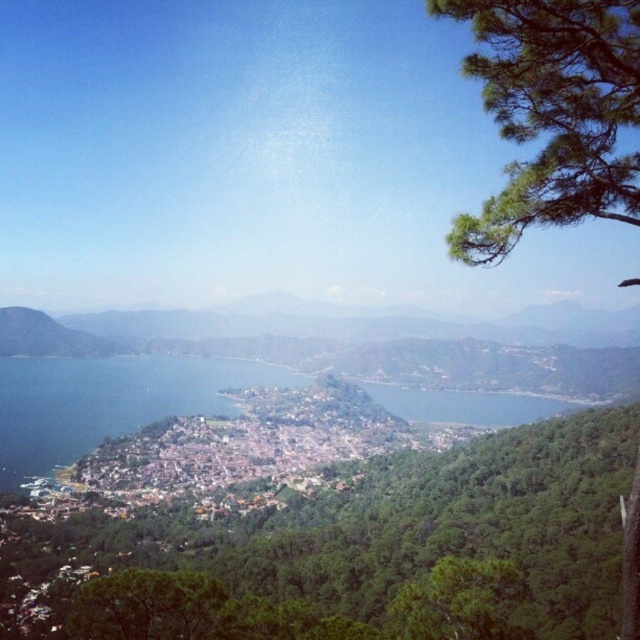
Between green leafy tree at center and green needle-like leaves at upper right, which one is positioned lower?

green leafy tree at center is below.

Does green leafy tree at center have a lesser height compared to green needle-like leaves at upper right?

Yes.

This screenshot has height=640, width=640. In order to click on green leafy tree at center in this screenshot , I will do `click(355, 552)`.

Image resolution: width=640 pixels, height=640 pixels. Identify the location of green leafy tree at center. (355, 552).